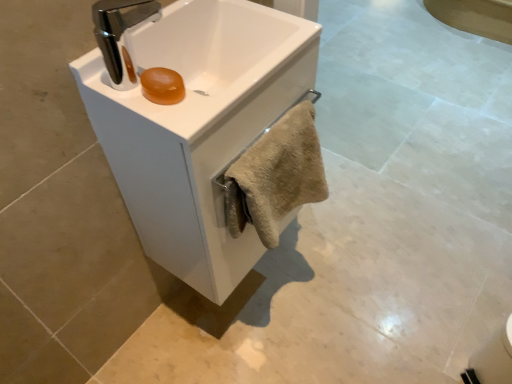
You are a GUI agent. You are given a task and a screenshot of the screen. Output one action in this format:
    pyautogui.click(x=<x>, y=<y>)
    Task: Click on the empty space that is ontop of beige fuzzy towel at center (from a real-world perspective)
    This screenshot has width=512, height=384.
    Given the screenshot: What is the action you would take?
    pyautogui.click(x=268, y=135)